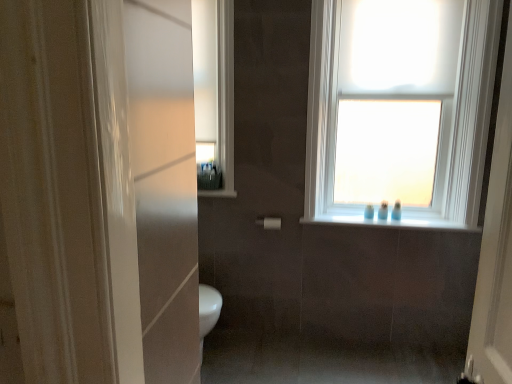
Locate an element on the screen. blue plastic toothbrushes at window, which appears as the second toiletry when viewed from the right is located at coordinates [x=383, y=211].

Find the location of `blue plastic bottle at upper right, the 3th toiletry in the right-to-left sequence`. blue plastic bottle at upper right, the 3th toiletry in the right-to-left sequence is located at coordinates (369, 212).

Measure the distance between point (369, 212) and camera.

They are 2.83 meters apart.

Describe the element at coordinates (396, 211) in the screenshot. I see `blue glossy toothbrush at upper right, placed as the first toiletry when sorted from right to left` at that location.

What do you see at coordinates (209, 178) in the screenshot?
I see `matte plastic toiletries at upper center, the 4th toiletry from the right` at bounding box center [209, 178].

The height and width of the screenshot is (384, 512). I want to click on white glossy window sill at upper center, which appears as the second window sill when viewed from the top, so click(x=389, y=223).

This screenshot has height=384, width=512. I want to click on blue plastic toothbrushes at window, which appears as the third toiletry when viewed from the left, so click(383, 211).

From the image's perspective, which one is positioned lower, white matte roller shade at upper right or blue plastic bottle at upper right, which is counted as the 2th toiletry, starting from the left?

From the image's view, blue plastic bottle at upper right, which is counted as the 2th toiletry, starting from the left, is below.

Does white matte roller shade at upper right have a lesser height compared to blue plastic bottle at upper right, which is counted as the 2th toiletry, starting from the left?

In fact, white matte roller shade at upper right may be taller than blue plastic bottle at upper right, which is counted as the 2th toiletry, starting from the left.

Choose the correct answer: Is white matte roller shade at upper right inside blue plastic bottle at upper right, the 3th toiletry in the right-to-left sequence, or outside it?

white matte roller shade at upper right is not enclosed by blue plastic bottle at upper right, the 3th toiletry in the right-to-left sequence.

Does white matte roller shade at upper right touch blue plastic bottle at upper right, the 3th toiletry in the right-to-left sequence?

No, white matte roller shade at upper right is not in contact with blue plastic bottle at upper right, the 3th toiletry in the right-to-left sequence.

In terms of size, does white glossy medicine cabinet at upper left appear bigger or smaller than white matte window at upper center?

Considering their sizes, white glossy medicine cabinet at upper left takes up less space than white matte window at upper center.

From the picture: Is white glossy medicine cabinet at upper left facing towards white matte window at upper center?

No, white glossy medicine cabinet at upper left is not facing towards white matte window at upper center.

From the image's perspective, which one is positioned higher, white glossy medicine cabinet at upper left or white matte window at upper center?

white glossy medicine cabinet at upper left is shown above in the image.

What's the angular difference between white glossy window sill at upper center, the 1th window sill from the right, and white matte roller shade at upper right's facing directions?

There is a 0.226-degree angle between the facing directions of white glossy window sill at upper center, the 1th window sill from the right, and white matte roller shade at upper right.

From a real-world perspective, is white glossy window sill at upper center, the first window sill positioned from the bottom, over white matte roller shade at upper right?

No, from a real-world perspective, white glossy window sill at upper center, the first window sill positioned from the bottom, is not above white matte roller shade at upper right.

Can you confirm if white glossy window sill at upper center, the 1th window sill from the right, is smaller than white matte roller shade at upper right?

Correct, white glossy window sill at upper center, the 1th window sill from the right, occupies less space than white matte roller shade at upper right.

Identify the location of light above the white glossy window sill at upper center, the first window sill positioned from the bottom (from the image's perspective). (393, 43).

In the image, is matte plastic toiletries at upper center, marked as the first toiletry in a left-to-right arrangement, positioned in front of or behind white glossy window sill at upper center, the 1th window sill from the right?

Clearly, matte plastic toiletries at upper center, marked as the first toiletry in a left-to-right arrangement, is behind white glossy window sill at upper center, the 1th window sill from the right.

From a real-world perspective, is matte plastic toiletries at upper center, the 4th toiletry from the right, positioned above or below white glossy window sill at upper center, which is the second window sill from left to right?

From a real-world perspective, matte plastic toiletries at upper center, the 4th toiletry from the right, is physically above white glossy window sill at upper center, which is the second window sill from left to right.

Is matte plastic toiletries at upper center, the 4th toiletry from the right, smaller than white glossy window sill at upper center, which is the second window sill from left to right?

Incorrect, matte plastic toiletries at upper center, the 4th toiletry from the right, is not smaller in size than white glossy window sill at upper center, which is the second window sill from left to right.

Is white matte towel bar at center spatially inside white glossy window sill at upper center, marked as the 1th window sill in a top-to-bottom arrangement, or outside of it?

white matte towel bar at center cannot be found inside white glossy window sill at upper center, marked as the 1th window sill in a top-to-bottom arrangement.

How many degrees apart are the facing directions of white matte towel bar at center and white glossy window sill at upper center, acting as the second window sill starting from the right?

1.29 degrees separate the facing orientations of white matte towel bar at center and white glossy window sill at upper center, acting as the second window sill starting from the right.

From the picture: Can you confirm if white matte towel bar at center is smaller than white glossy window sill at upper center, marked as the 1th window sill in a top-to-bottom arrangement?

Incorrect, white matte towel bar at center is not smaller in size than white glossy window sill at upper center, marked as the 1th window sill in a top-to-bottom arrangement.

Could you measure the distance between white matte towel bar at center and white glossy window sill at upper center, placed as the 2th window sill when sorted from bottom to top?

white matte towel bar at center and white glossy window sill at upper center, placed as the 2th window sill when sorted from bottom to top, are 30.40 centimeters apart from each other.

From a real-world perspective, which object stands above the other?

From a 3D spatial view, blue glossy toothbrush at upper right, the 4th toiletry positioned from the left, is above.

Considering the sizes of objects white glossy window sill at upper center, which is the second window sill from left to right, and blue glossy toothbrush at upper right, the 4th toiletry positioned from the left, in the image provided, who is shorter, white glossy window sill at upper center, which is the second window sill from left to right, or blue glossy toothbrush at upper right, the 4th toiletry positioned from the left,?

white glossy window sill at upper center, which is the second window sill from left to right, is shorter.

Which of these two, white glossy window sill at upper center, the first window sill positioned from the bottom, or blue glossy toothbrush at upper right, the 4th toiletry positioned from the left, is thinner?

blue glossy toothbrush at upper right, the 4th toiletry positioned from the left.

How much distance is there between white glossy medicine cabinet at upper left and white matte roller shade at upper right?

A distance of 37.68 inches exists between white glossy medicine cabinet at upper left and white matte roller shade at upper right.

Is white glossy medicine cabinet at upper left touching white matte roller shade at upper right?

white glossy medicine cabinet at upper left and white matte roller shade at upper right are clearly separated.

Is white glossy medicine cabinet at upper left turned away from white matte roller shade at upper right?

No, white glossy medicine cabinet at upper left is not facing the opposite direction of white matte roller shade at upper right.

Which is more to the right, white glossy medicine cabinet at upper left or white matte roller shade at upper right?

white matte roller shade at upper right is more to the right.

This screenshot has width=512, height=384. In order to click on the 4th toiletry below the white matte roller shade at upper right (from the image's perspective) in this screenshot , I will do `click(369, 212)`.

I want to click on medicine cabinet that is above the white matte window at upper center (from a real-world perspective), so click(215, 85).

When comparing their distances from white glossy window sill at upper center, which is the second window sill from left to right, does white matte roller shade at upper right or blue plastic bottle at upper right, which is counted as the 2th toiletry, starting from the left, seem closer?

Among the two, blue plastic bottle at upper right, which is counted as the 2th toiletry, starting from the left, is located nearer to white glossy window sill at upper center, which is the second window sill from left to right.

Estimate the real-world distances between objects in this image. Which object is closer to white glossy window sill at upper center, marked as the 1th window sill in a left-to-right arrangement, blue plastic toothbrushes at window, which appears as the second toiletry when viewed from the right, or white glossy window sill at upper center, the first window sill positioned from the bottom?

white glossy window sill at upper center, the first window sill positioned from the bottom, lies closer to white glossy window sill at upper center, marked as the 1th window sill in a left-to-right arrangement, than the other object.

Which object lies nearer to the anchor point white glossy window sill at upper center, placed as the 2th window sill when sorted from bottom to top, white matte towel bar at center or blue plastic bottle at upper right, the 3th toiletry in the right-to-left sequence?

white matte towel bar at center is positioned closer to the anchor white glossy window sill at upper center, placed as the 2th window sill when sorted from bottom to top.

Based on the photo, when comparing their distances from white matte towel bar at center, does white glossy window sill at upper center, marked as the 1th window sill in a top-to-bottom arrangement, or white matte window at upper center seem further?

The object further to white matte towel bar at center is white matte window at upper center.

When comparing their distances from white matte window at upper center, does blue plastic toothbrushes at window, which appears as the second toiletry when viewed from the right, or white glossy window sill at upper center, the 1th window sill from the right, seem further?

blue plastic toothbrushes at window, which appears as the second toiletry when viewed from the right, is further to white matte window at upper center.

Estimate the real-world distances between objects in this image. Which object is further from matte plastic toiletries at upper center, marked as the first toiletry in a left-to-right arrangement, white glossy medicine cabinet at upper left or white glossy window sill at upper center, marked as the 1th window sill in a top-to-bottom arrangement?

white glossy medicine cabinet at upper left is further to matte plastic toiletries at upper center, marked as the first toiletry in a left-to-right arrangement.

Estimate the real-world distances between objects in this image. Which object is further from blue glossy toothbrush at upper right, the 4th toiletry positioned from the left, white matte towel bar at center or white matte window at upper center?

white matte towel bar at center lies further to blue glossy toothbrush at upper right, the 4th toiletry positioned from the left, than the other object.

When comparing their distances from white glossy window sill at upper center, placed as the 2th window sill when sorted from bottom to top, does white matte towel bar at center or white matte roller shade at upper right seem further?

The object further to white glossy window sill at upper center, placed as the 2th window sill when sorted from bottom to top, is white matte roller shade at upper right.

The height and width of the screenshot is (384, 512). Find the location of `towel bar between white glossy window sill at upper center, marked as the 1th window sill in a top-to-bottom arrangement, and blue plastic toothbrushes at window, which appears as the third toiletry when viewed from the left`. towel bar between white glossy window sill at upper center, marked as the 1th window sill in a top-to-bottom arrangement, and blue plastic toothbrushes at window, which appears as the third toiletry when viewed from the left is located at coordinates (269, 223).

I want to click on medicine cabinet situated between matte plastic toiletries at upper center, marked as the first toiletry in a left-to-right arrangement, and blue plastic toothbrushes at window, which appears as the second toiletry when viewed from the right, from left to right, so click(x=215, y=85).

This screenshot has height=384, width=512. Identify the location of window sill located between matte plastic toiletries at upper center, marked as the first toiletry in a left-to-right arrangement, and white matte roller shade at upper right in the left-right direction. (217, 193).

At what (x,y) coordinates should I click in order to perform the action: click on window sill between white glossy medicine cabinet at upper left and blue plastic bottle at upper right, the 3th toiletry in the right-to-left sequence, in the horizontal direction. Please return your answer as a coordinate pair (x, y). This screenshot has width=512, height=384. Looking at the image, I should click on (217, 193).